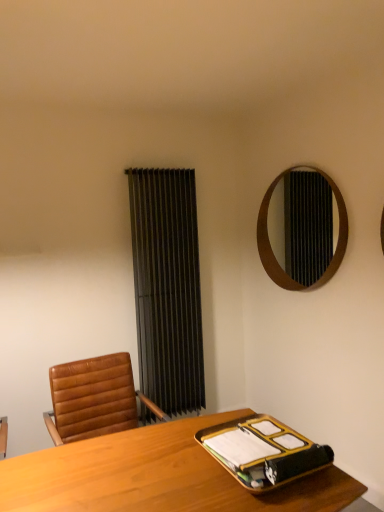
You are a GUI agent. You are given a task and a screenshot of the screen. Output one action in this format:
    pyautogui.click(x=<x>, y=<y>)
    Task: Click on the free location to the left of gold metallic binder at lower right
    Image resolution: width=384 pixels, height=512 pixels.
    Given the screenshot: What is the action you would take?
    pyautogui.click(x=161, y=461)